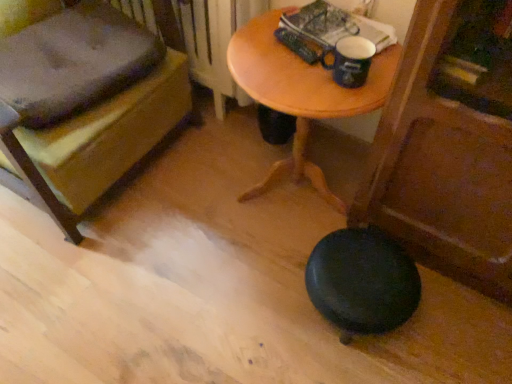
Question: Looking at their shapes, would you say wooden bench at lower left is wider or thinner than wooden table at center?

Choices:
 (A) wide
 (B) thin

Answer: (A)

Question: Relative to wooden table at center, is wooden bench at lower left in front or behind?

Choices:
 (A) behind
 (B) front

Answer: (B)

Question: Estimate the real-world distances between objects in this image. Which object is closer to the white plastic radiator at upper center?

Choices:
 (A) wooden table at center
 (B) blue ceramic mug at upper center
 (C) black rubber stool at lower right
 (D) wooden bench at lower left

Answer: (A)

Question: Considering the real-world distances, which object is closest to the wooden table at center?

Choices:
 (A) black rubber stool at lower right
 (B) wooden bench at lower left
 (C) white plastic radiator at upper center
 (D) blue ceramic mug at upper center

Answer: (D)